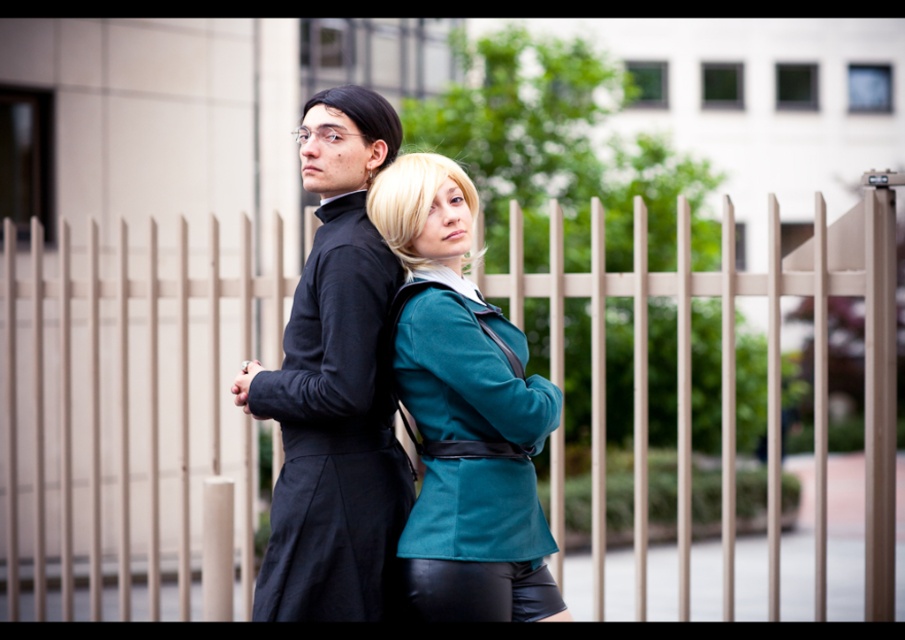
Question: Which point is farther to the camera?

Choices:
 (A) matte black suit at center
 (B) teal fabric jacket at center
 (C) metallic silver fence at center

Answer: (C)

Question: Is metallic silver fence at center to the left of teal fabric jacket at center from the viewer's perspective?

Choices:
 (A) no
 (B) yes

Answer: (B)

Question: Does metallic silver fence at center have a greater width compared to teal fabric jacket at center?

Choices:
 (A) yes
 (B) no

Answer: (A)

Question: Estimate the real-world distances between objects in this image. Which object is closer to the teal fabric jacket at center?

Choices:
 (A) matte black suit at center
 (B) metallic silver fence at center

Answer: (A)

Question: Does matte black suit at center appear on the right side of teal fabric jacket at center?

Choices:
 (A) yes
 (B) no

Answer: (B)

Question: Which point appears farthest from the camera in this image?

Choices:
 (A) (507, 321)
 (B) (7, 314)
 (C) (322, 576)

Answer: (B)